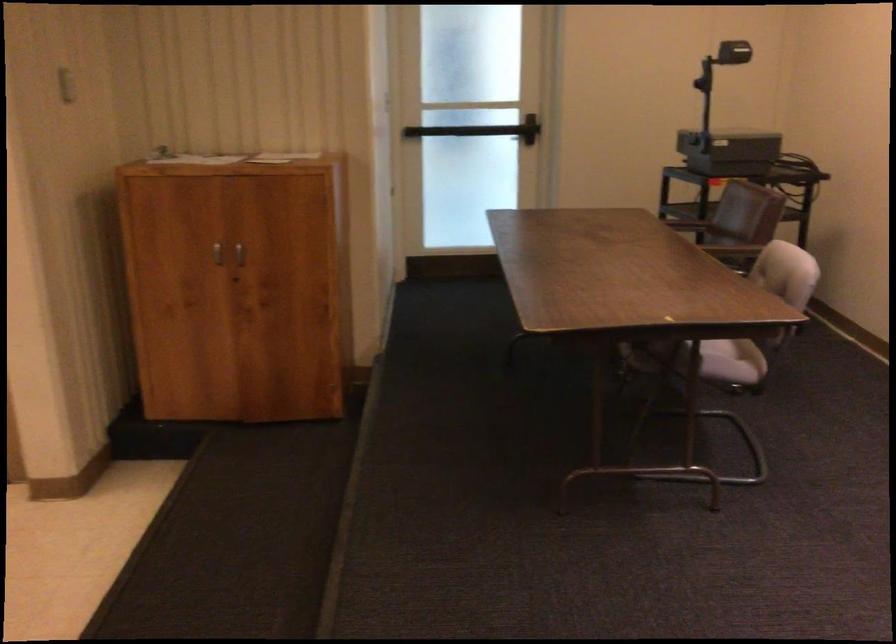
Find the location of a particular element. This screenshot has height=644, width=896. projector head is located at coordinates (729, 53).